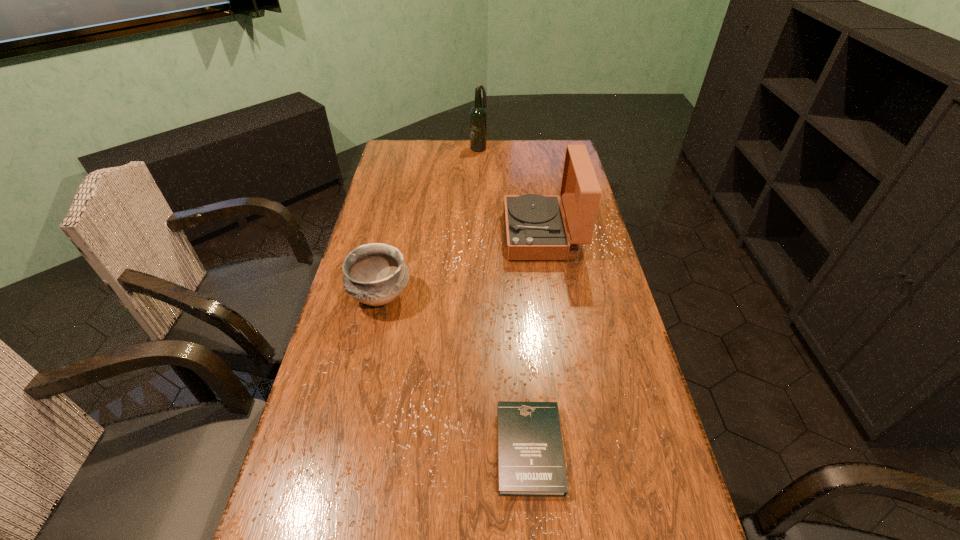
Identify the location of beer bottle. (478, 117).

Find the location of `the farthest object`. the farthest object is located at coordinates (478, 117).

You are a GUI agent. You are given a task and a screenshot of the screen. Output one action in this format:
    pyautogui.click(x=<x>, y=<y>)
    Task: Click on the third nearest object
    Image resolution: width=960 pixels, height=540 pixels.
    Given the screenshot: What is the action you would take?
    pyautogui.click(x=535, y=229)

Locate an element on the screen. The height and width of the screenshot is (540, 960). the third tallest object is located at coordinates (375, 274).

Identify the location of the leftmost object. The height and width of the screenshot is (540, 960). (375, 274).

You are a GUI agent. You are given a task and a screenshot of the screen. Output one action in this format:
    pyautogui.click(x=<x>, y=<y>)
    Task: Click on the book
    This screenshot has width=960, height=540.
    Given the screenshot: What is the action you would take?
    pyautogui.click(x=531, y=463)

I want to click on the shortest object, so click(x=531, y=463).

Locate an element on the screen. vacant space located on the left of the farthest object is located at coordinates (390, 148).

Locate an element on the screen. vacant space located 0.400m on the face of the second farthest object is located at coordinates (389, 235).

This screenshot has height=540, width=960. I want to click on vacant space located 0.310m on the face of the second farthest object, so click(x=415, y=235).